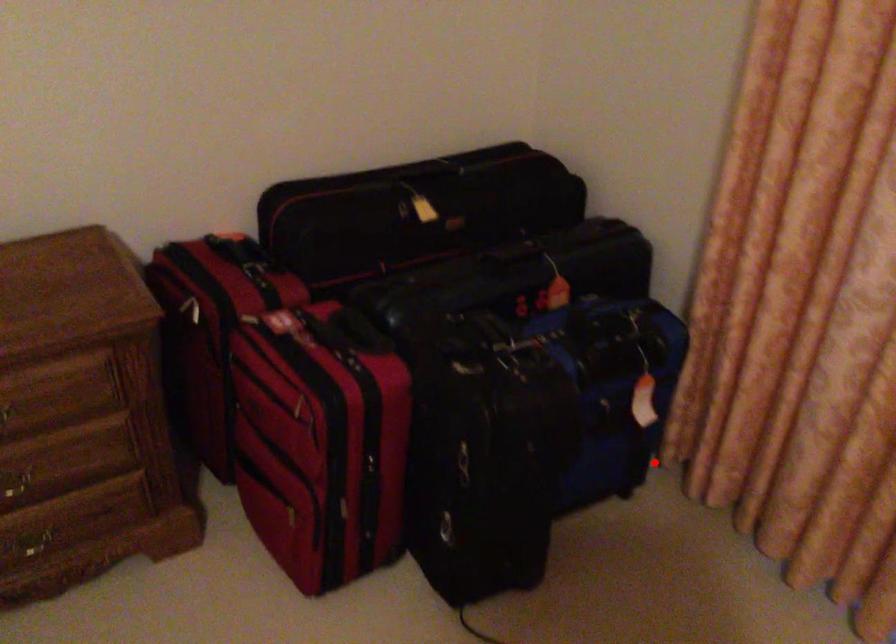
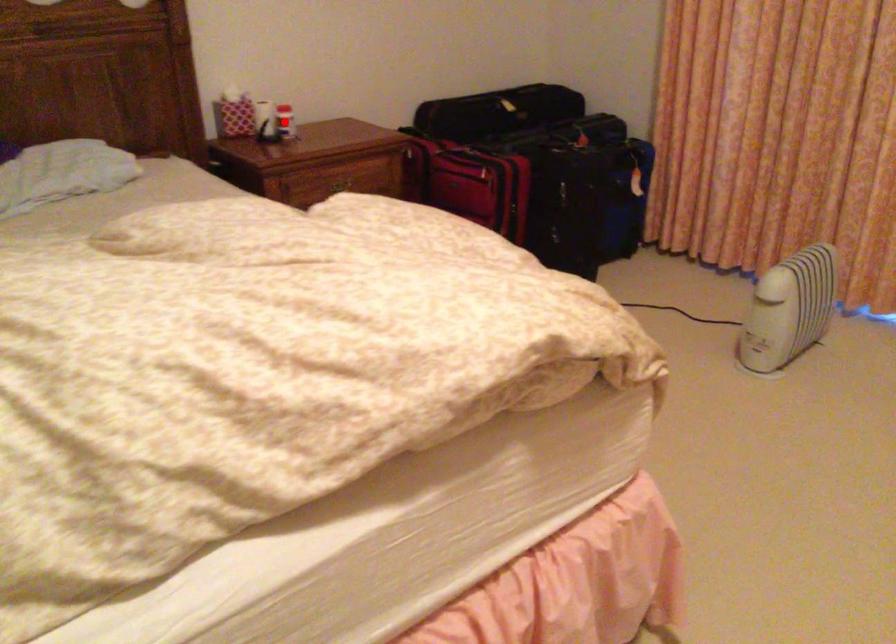
I am providing you with two images of the same scene from different viewpoints. A red point is marked on the first image and another point is marked on the second image. Does the point marked in image1 correspond to the same location as the one in image2?

No